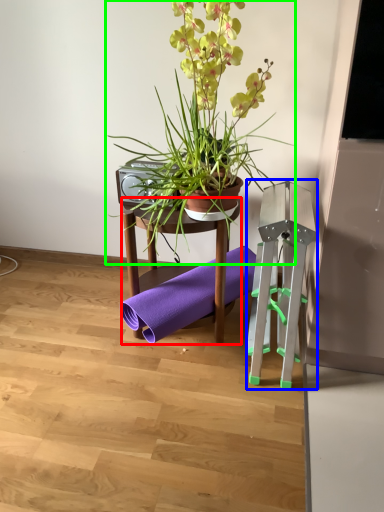
Question: Estimate the real-world distances between objects in this image. Which object is closer to furniture (highlighted by a red box), easel (highlighted by a blue box) or houseplant (highlighted by a green box)?

Choices:
 (A) easel
 (B) houseplant

Answer: (B)